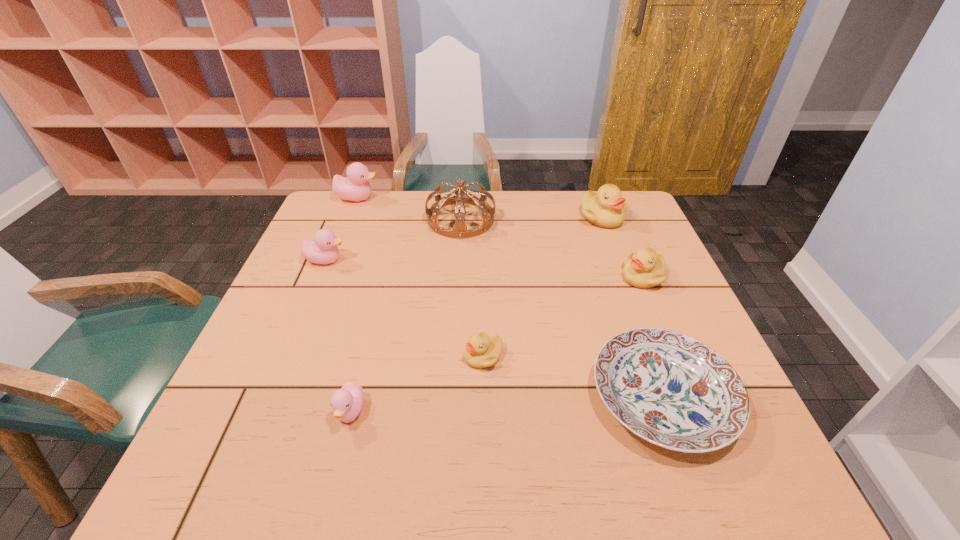
Identify the location of free region that satisfies the following two spatial constraints: 1. on the front-facing side of the third duckling from right to left; 2. on the front-facing side of the third duckling from left to right. This screenshot has height=540, width=960. (484, 412).